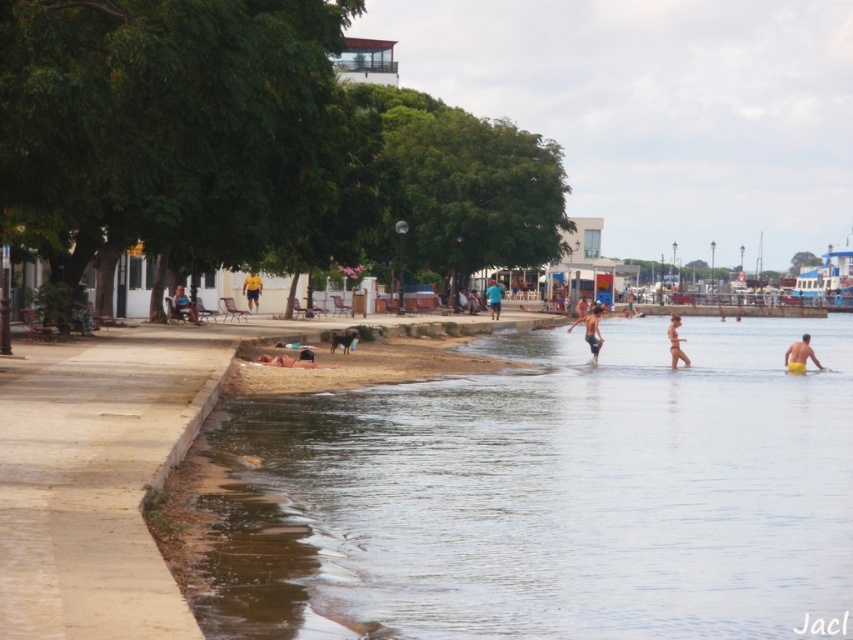
Question: Does yellow fabric person at right appear under yellow fabric person at center?

Choices:
 (A) yes
 (B) no

Answer: (A)

Question: Does white matte bikini at center lie in front of blue denim shorts at left?

Choices:
 (A) yes
 (B) no

Answer: (A)

Question: Which of these objects is positioned farthest from the dark brown leather dog at lower center?

Choices:
 (A) yellow fabric person at center
 (B) blue denim shorts at left
 (C) blue fabric shirt at center

Answer: (C)

Question: Which point is closer to the camera?

Choices:
 (A) (251, 307)
 (B) (828, 406)
 (C) (186, 301)
 (D) (683, 355)

Answer: (B)

Question: Can you confirm if clear water at lower center is positioned above dark brown leather bag at lower center?

Choices:
 (A) yes
 (B) no

Answer: (B)

Question: Which object appears closest to the camera in this image?

Choices:
 (A) dark brown leather bag at lower center
 (B) dark brown leather dog at lower center

Answer: (B)